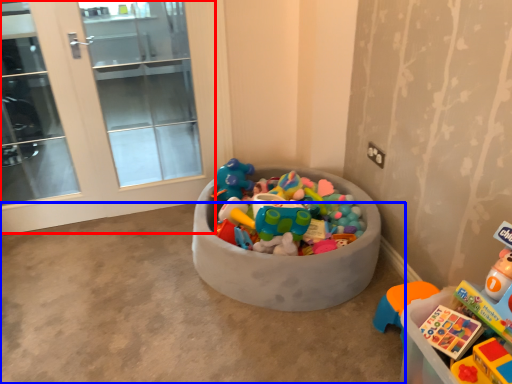
Question: Which object is closer to the camera taking this photo, screen door (highlighted by a red box) or concrete (highlighted by a blue box)?

Choices:
 (A) screen door
 (B) concrete

Answer: (B)